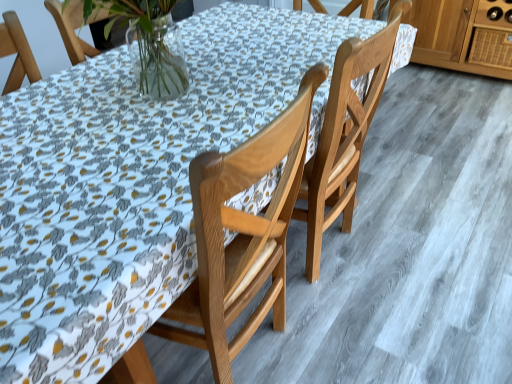
The height and width of the screenshot is (384, 512). I want to click on wooden chair at center, which is the 1th chair from left to right, so click(242, 234).

The width and height of the screenshot is (512, 384). Find the location of `light brown wood chair at center, arranged as the second chair when viewed from the left`. light brown wood chair at center, arranged as the second chair when viewed from the left is located at coordinates (344, 135).

Can you confirm if light brown wood chair at center, arranged as the second chair when viewed from the left, is positioned to the right of wooden drawer at upper right?

No, light brown wood chair at center, arranged as the second chair when viewed from the left, is not to the right of wooden drawer at upper right.

Is light brown wood chair at center, which is the 1th chair in right-to-left order, smaller than wooden drawer at upper right?

Actually, light brown wood chair at center, which is the 1th chair in right-to-left order, might be larger than wooden drawer at upper right.

Does light brown wood chair at center, which is the 1th chair in right-to-left order, come in front of wooden drawer at upper right?

Yes, light brown wood chair at center, which is the 1th chair in right-to-left order, is closer to the camera.

Is wooden chair at center, acting as the second chair starting from the right, far from wooden drawer at upper right?

That's right, there is a large distance between wooden chair at center, acting as the second chair starting from the right, and wooden drawer at upper right.

Based on their sizes in the image, would you say wooden chair at center, acting as the second chair starting from the right, is bigger or smaller than wooden drawer at upper right?

wooden chair at center, acting as the second chair starting from the right, is bigger than wooden drawer at upper right.

Could you measure the distance between wooden chair at center, which is the 1th chair from left to right, and wooden drawer at upper right?

wooden chair at center, which is the 1th chair from left to right, and wooden drawer at upper right are 2.60 meters apart from each other.

In terms of height, does wooden chair at center, which is the 1th chair from left to right, look taller or shorter compared to wooden drawer at upper right?

Clearly, wooden chair at center, which is the 1th chair from left to right, is taller compared to wooden drawer at upper right.

Does wooden drawer at upper right appear on the left side of wooden chair at center, which is the 1th chair from left to right?

No.

Is wooden drawer at upper right aimed at wooden chair at center, which is the 1th chair from left to right?

Yes.

Can you tell me how much wooden drawer at upper right and wooden chair at center, acting as the second chair starting from the right, differ in facing direction?

The angle between the facing direction of wooden drawer at upper right and the facing direction of wooden chair at center, acting as the second chair starting from the right, is 90.9 degrees.

Which object is positioned more to the left, light brown wood chair at center, arranged as the second chair when viewed from the left, or wooden chair at center, acting as the second chair starting from the right?

Positioned to the left is wooden chair at center, acting as the second chair starting from the right.

Does light brown wood chair at center, arranged as the second chair when viewed from the left, turn towards wooden chair at center, acting as the second chair starting from the right?

No, light brown wood chair at center, arranged as the second chair when viewed from the left, is not oriented towards wooden chair at center, acting as the second chair starting from the right.

Identify the location of chair above the wooden chair at center, acting as the second chair starting from the right (from a real-world perspective). (344, 135).

Considering the relative sizes of light brown wood chair at center, arranged as the second chair when viewed from the left, and wooden chair at center, acting as the second chair starting from the right, in the image provided, is light brown wood chair at center, arranged as the second chair when viewed from the left, shorter than wooden chair at center, acting as the second chair starting from the right,?

Incorrect, the height of light brown wood chair at center, arranged as the second chair when viewed from the left, does not fall short of that of wooden chair at center, acting as the second chair starting from the right.

Can you tell me how much wooden chair at center, which is the 1th chair from left to right, and light brown wood chair at center, arranged as the second chair when viewed from the left, differ in facing direction?

The angular difference between wooden chair at center, which is the 1th chair from left to right, and light brown wood chair at center, arranged as the second chair when viewed from the left, is 0.000163 degrees.

Which is behind, wooden chair at center, which is the 1th chair from left to right, or light brown wood chair at center, arranged as the second chair when viewed from the left?

light brown wood chair at center, arranged as the second chair when viewed from the left, is further from the camera.

Is light brown wood chair at center, arranged as the second chair when viewed from the left, a part of wooden chair at center, which is the 1th chair from left to right?

Actually, light brown wood chair at center, arranged as the second chair when viewed from the left, is outside wooden chair at center, which is the 1th chair from left to right.

Consider the image. Which object is wider, wooden chair at center, which is the 1th chair from left to right, or light brown wood chair at center, arranged as the second chair when viewed from the left?

light brown wood chair at center, arranged as the second chair when viewed from the left, is wider.

Can we say wooden drawer at upper right lies outside light brown wood chair at center, arranged as the second chair when viewed from the left?

wooden drawer at upper right lies outside light brown wood chair at center, arranged as the second chair when viewed from the left,'s area.

Which of these two, wooden drawer at upper right or light brown wood chair at center, which is the 1th chair in right-to-left order, is wider?

light brown wood chair at center, which is the 1th chair in right-to-left order.

Between wooden drawer at upper right and light brown wood chair at center, arranged as the second chair when viewed from the left, which one has smaller size?

wooden drawer at upper right.

From the image's perspective, is wooden drawer at upper right located above light brown wood chair at center, arranged as the second chair when viewed from the left?

Yes, from the image's perspective, wooden drawer at upper right is above light brown wood chair at center, arranged as the second chair when viewed from the left.

From the wooden drawer at upper right, count the 1st chair to the left and point to it. Please provide its 2D coordinates.

[(344, 135)]

Which chair is the 2nd one when counting from the front of the wooden drawer at upper right? Please provide its 2D coordinates.

[(242, 234)]

Looking at the image, which one is located further to wooden drawer at upper right, light brown wood chair at center, arranged as the second chair when viewed from the left, or wooden chair at center, acting as the second chair starting from the right?

Based on the image, wooden chair at center, acting as the second chair starting from the right, appears to be further to wooden drawer at upper right.

Based on their spatial positions, is light brown wood chair at center, arranged as the second chair when viewed from the left, or wooden drawer at upper right further from wooden chair at center, acting as the second chair starting from the right?

wooden drawer at upper right lies further to wooden chair at center, acting as the second chair starting from the right, than the other object.

Considering their positions, is wooden chair at center, which is the 1th chair from left to right, positioned closer to light brown wood chair at center, arranged as the second chair when viewed from the left, than wooden drawer at upper right?

wooden chair at center, which is the 1th chair from left to right.

From the image, which object appears to be farther from wooden drawer at upper right, wooden chair at center, acting as the second chair starting from the right, or light brown wood chair at center, arranged as the second chair when viewed from the left?

Based on the image, wooden chair at center, acting as the second chair starting from the right, appears to be further to wooden drawer at upper right.

Estimate the real-world distances between objects in this image. Which object is further from light brown wood chair at center, arranged as the second chair when viewed from the left, wooden drawer at upper right or wooden chair at center, acting as the second chair starting from the right?

Based on the image, wooden drawer at upper right appears to be further to light brown wood chair at center, arranged as the second chair when viewed from the left.

Looking at the image, which one is located closer to wooden chair at center, acting as the second chair starting from the right, wooden drawer at upper right or light brown wood chair at center, which is the 1th chair in right-to-left order?

Among the two, light brown wood chair at center, which is the 1th chair in right-to-left order, is located nearer to wooden chair at center, acting as the second chair starting from the right.

This screenshot has height=384, width=512. Identify the location of chair between wooden chair at center, acting as the second chair starting from the right, and wooden drawer at upper right in the front-back direction. click(344, 135).